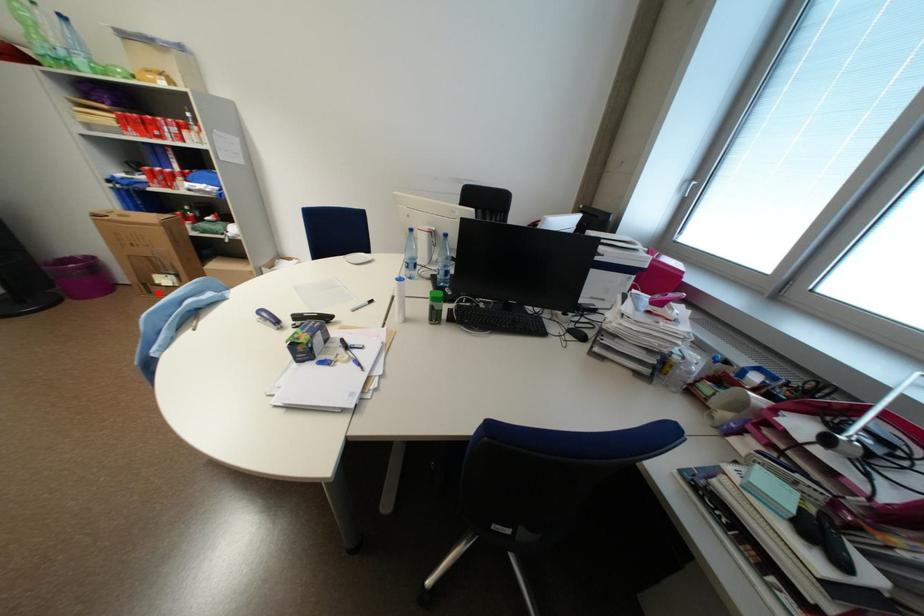
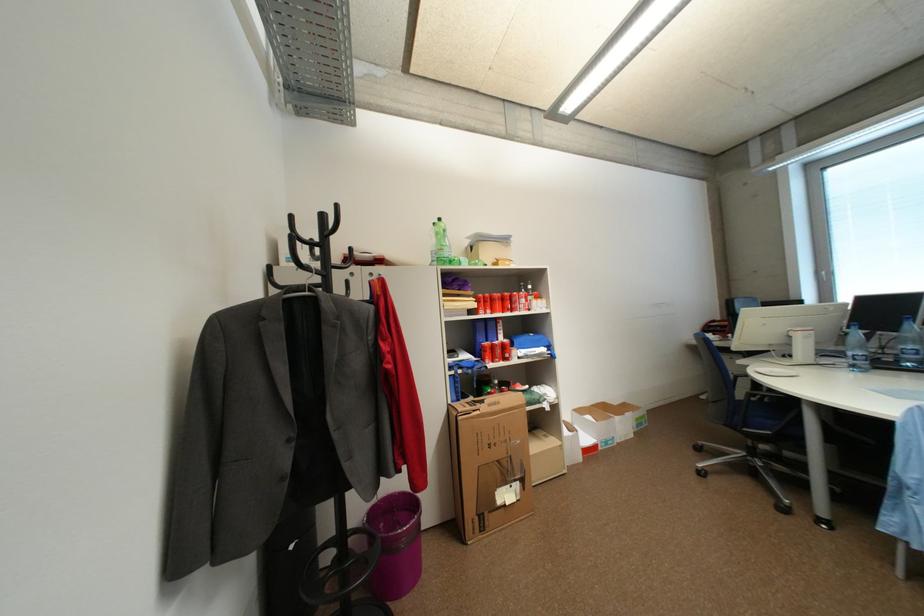
Where in the second image is the point corresponding to the highlighted location from the first image?

(491, 529)